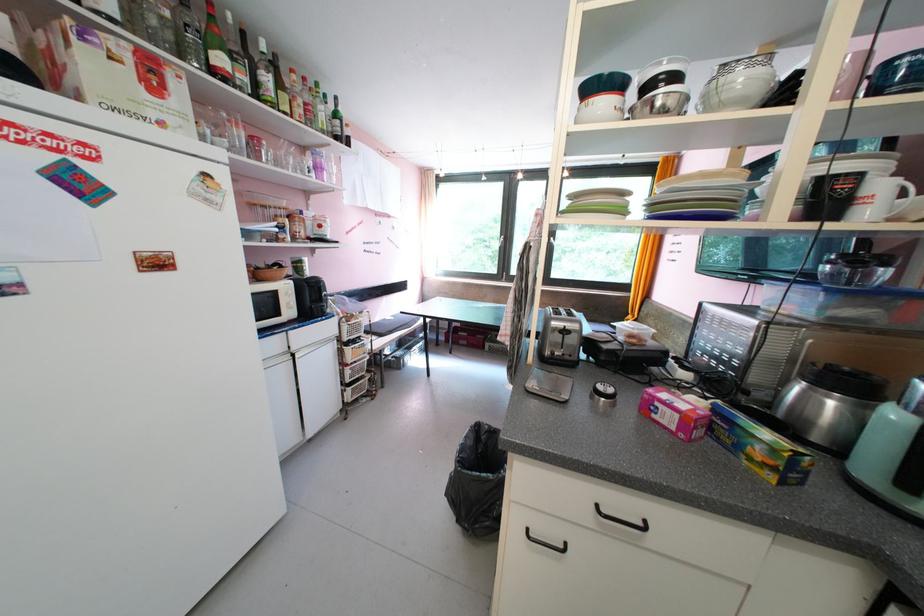
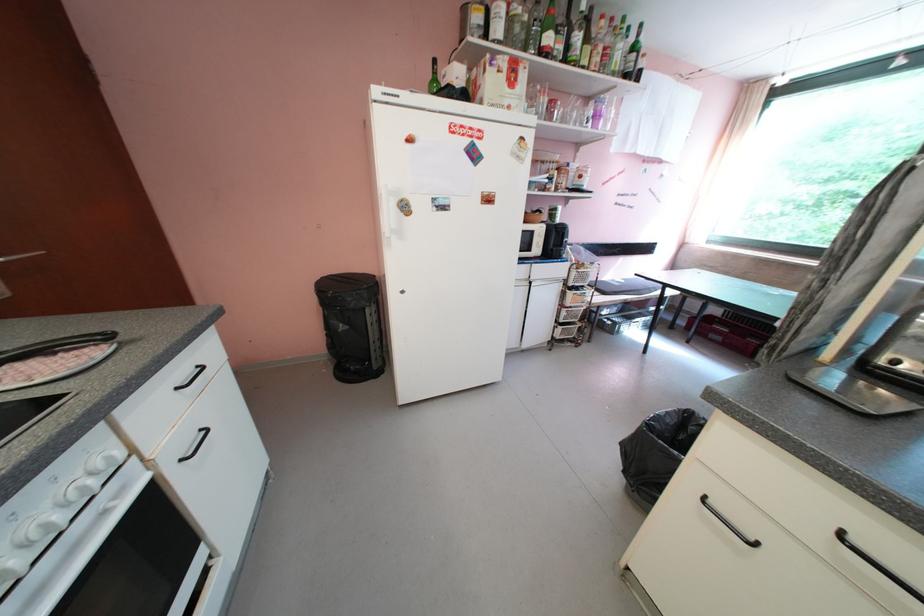
The point at (332, 132) is marked in the first image. Where is the corresponding point in the second image?

(622, 75)